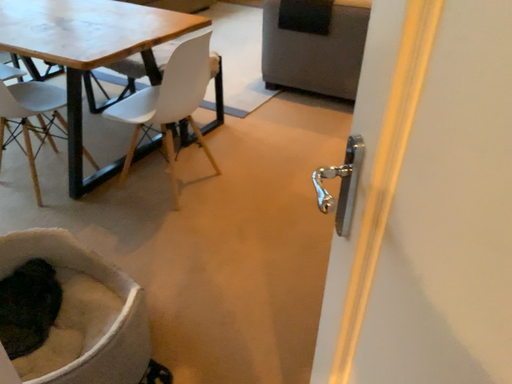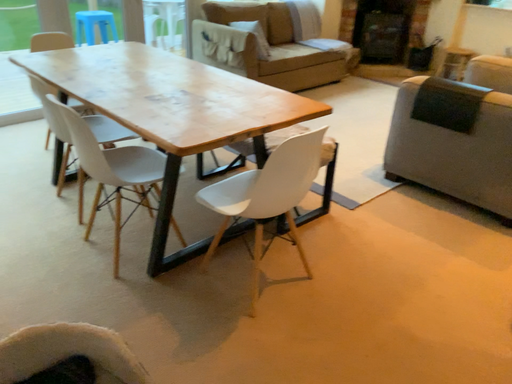
Question: How did the camera likely rotate when shooting the video?

Choices:
 (A) rotated right
 (B) rotated left

Answer: (B)